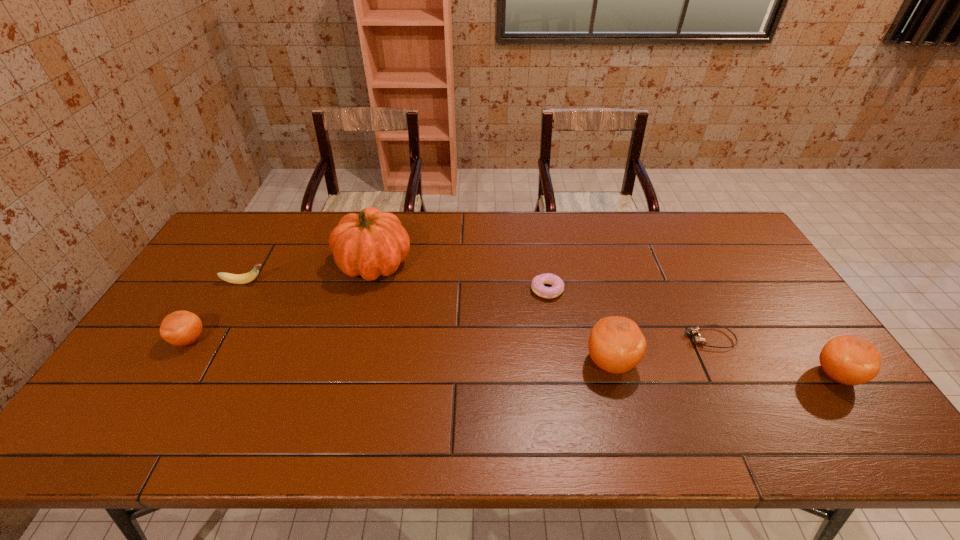
You are a GUI agent. You are given a task and a screenshot of the screen. Output one action in this format:
    pyautogui.click(x=<x>, y=<y>)
    Task: Click on the free spot that satisfies the following two spatial constraints: 1. on the front side of the fourth object from right to left; 2. on the right side of the pumpkin
    The width and height of the screenshot is (960, 540).
    Given the screenshot: What is the action you would take?
    pyautogui.click(x=368, y=290)

Identify the location of vacant space that satisfies the following two spatial constraints: 1. at the stem of the rightmost orange; 2. on the left side of the banana. This screenshot has height=540, width=960. (193, 375).